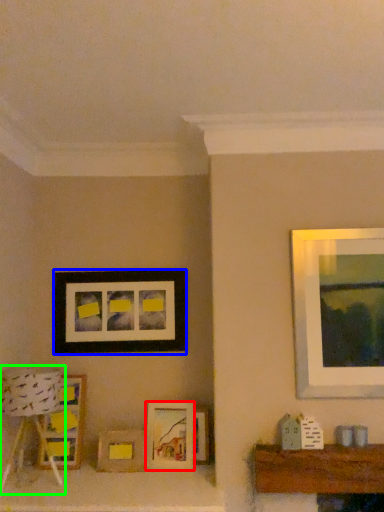
Question: Which object is the closest to the picture frame (highlighted by a red box)? Choose among these: picture frame (highlighted by a blue box) or lamp (highlighted by a green box).

Choices:
 (A) picture frame
 (B) lamp

Answer: (A)